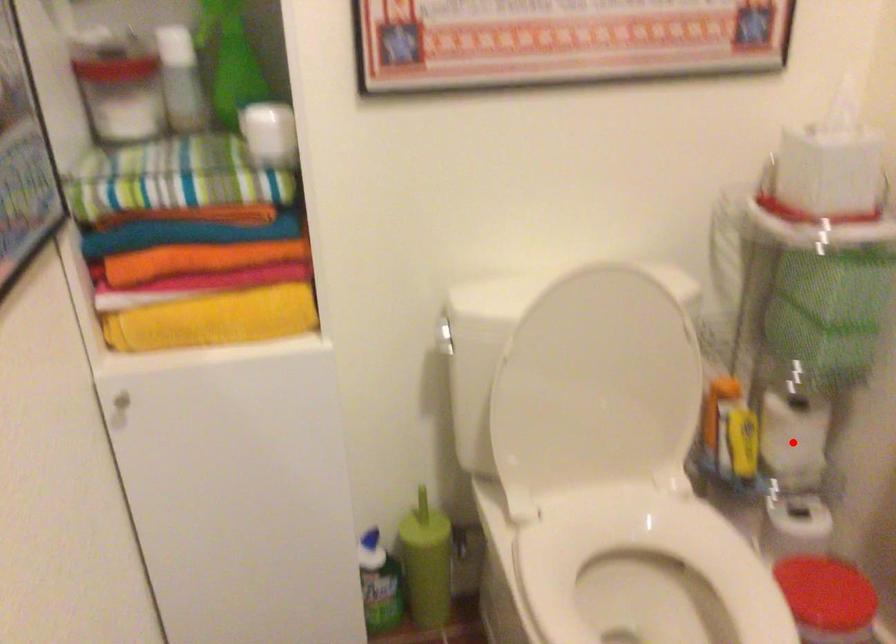
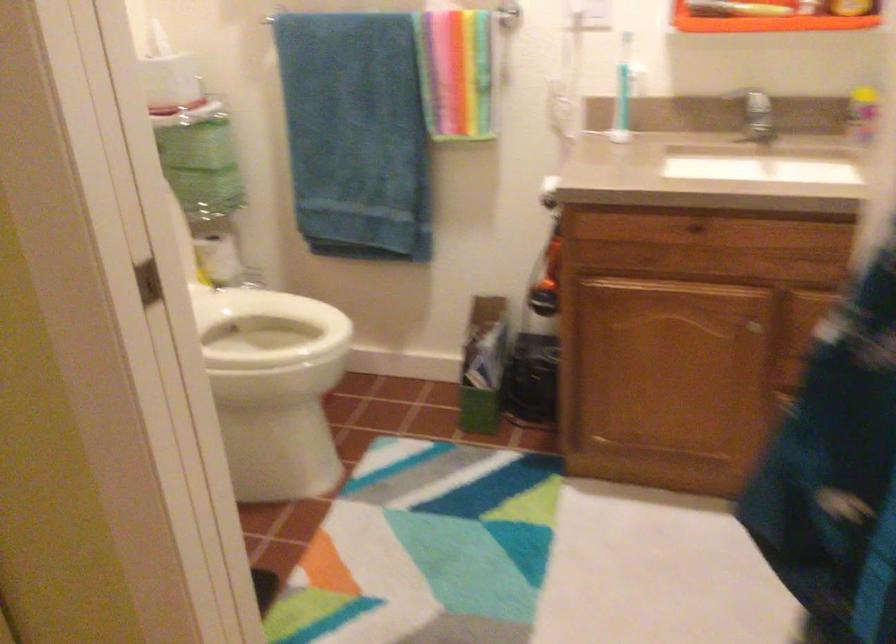
Question: I am providing you with two images of the same scene from different viewpoints. In image1, a red point is highlighted. Considering the same 3D point in image2, which of the following is correct?

Choices:
 (A) It is closer
 (B) It is farther

Answer: (B)